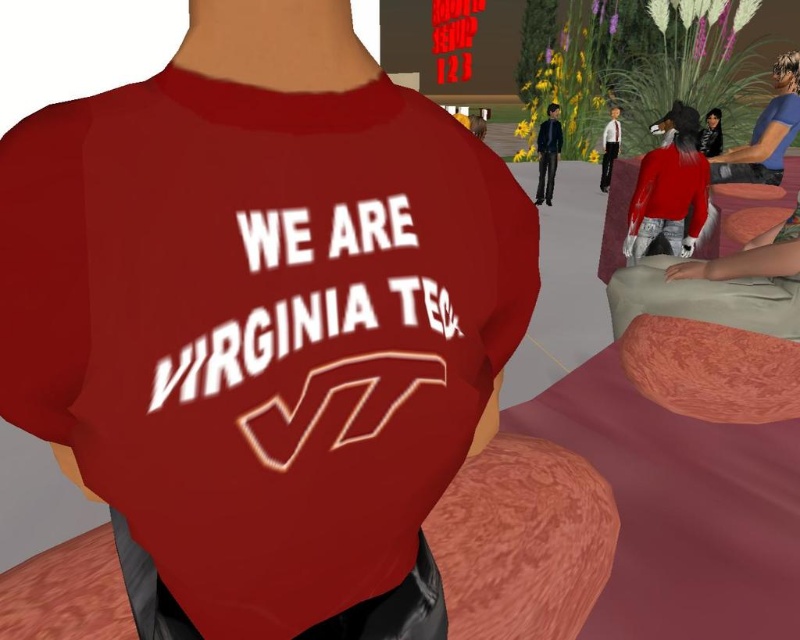
You are a photographer trying to capture a group photo of the characters in the scene. You notice the matte red shirt at center and the matte white shirt at upper right. Which shirt should you focus on first to ensure both are in frame, considering their sizes?

The matte red shirt at center has a greater height compared to the matte white shirt at upper right, so you should focus on the matte red shirt at center first to ensure both are in frame, as it is larger and might require more adjustment.

Consider the image. You are a photographer at the event and need to capture both the matte red shirt at center and the matte white shirt at upper right in the same frame. Can you position yourself so that both are visible without one blocking the other?

The matte red shirt at center is in front of the matte white shirt at upper right, so positioning yourself to the side or at an angle might allow both to be visible without one blocking the other.

You are a character in the scene and want to greet the person wearing the blue fabric shirt at upper right. Since you are standing near the matte black jacket at center, can you directly see and approach them without any obstructions?

The blue fabric shirt at upper right is in front of the matte black jacket at center, so yes, you can directly see and approach the person wearing the blue fabric shirt at upper right without any obstructions.